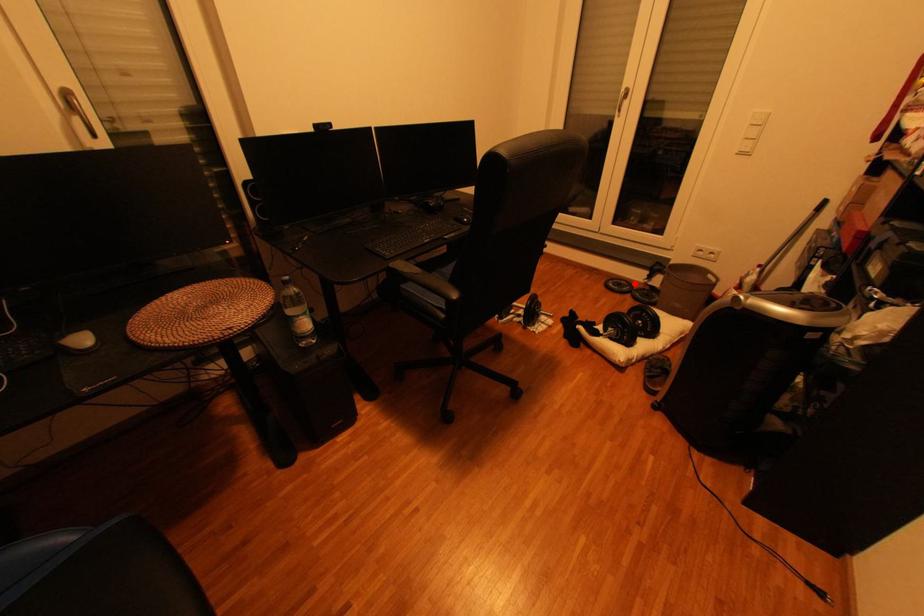
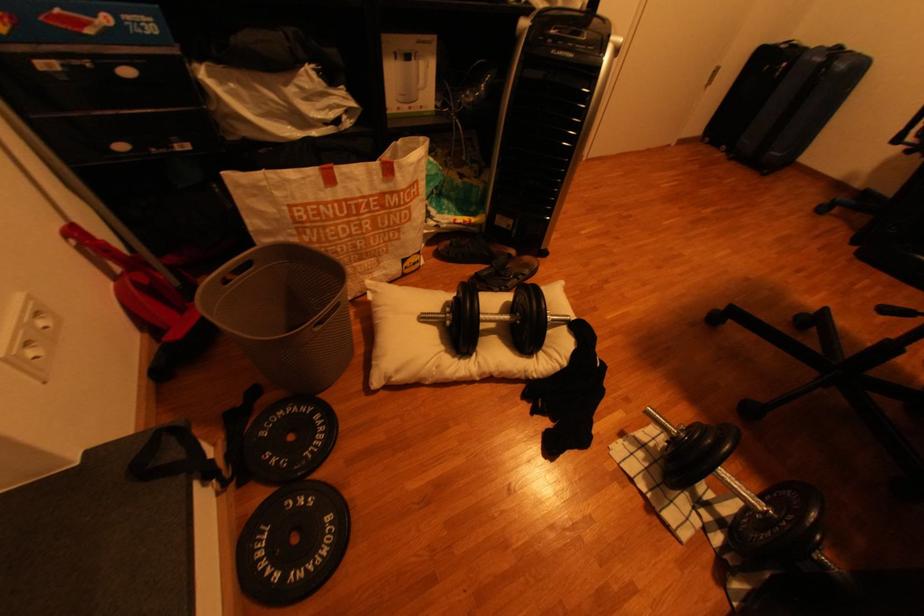
Question: A red point is marked in image1. In image2, is the corresponding 3D point closer to the camera or farther? Reply with the corresponding letter.

Choices:
 (A) The corresponding 3D point is closer.
 (B) The corresponding 3D point is farther.

Answer: (A)